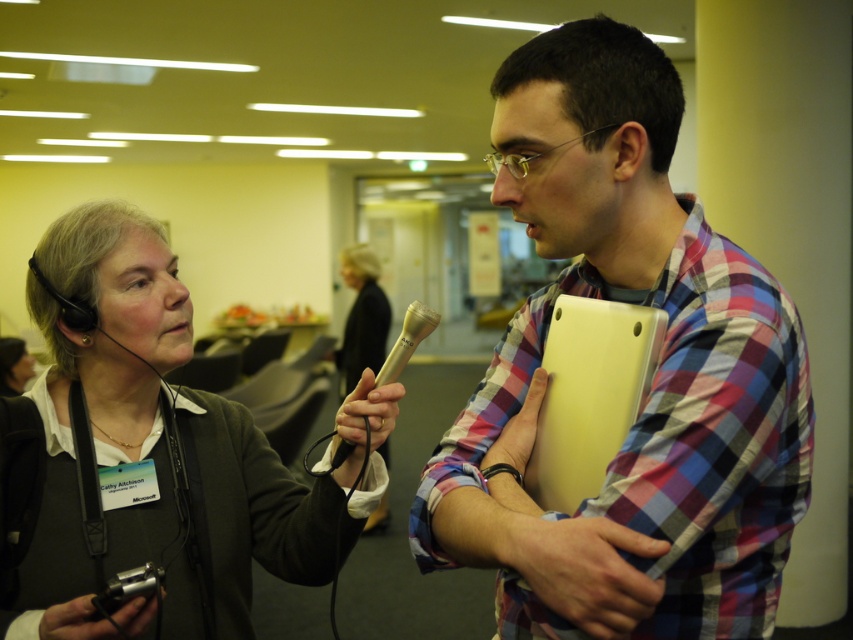
You are a photographer in the room. You need to adjust the lighting so that both the matte black headset at left and the matte black microphone at center are well lit. Since the headset is above the microphone, which one might cast a shadow on the other if the light is coming from above?

The matte black headset at left is above the matte black microphone at center, so if the light is coming from above, the matte black headset at left could cast a shadow on the matte black microphone at center.

In the scene shown: You are a photographer in the room and need to adjust your equipment. The matte black headset at left and the matte black microphone at center are both in your way. Which object should you move first to ensure you have enough vertical space?

The matte black headset at left is shorter than the matte black microphone at center, so you should move the matte black microphone at center first to free up more vertical space.